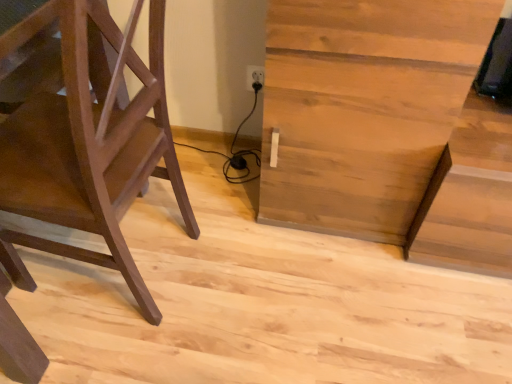
Question: Is light brown wood table at center bigger than matte brown ladder at left?

Choices:
 (A) yes
 (B) no

Answer: (A)

Question: Are light brown wood table at center and matte brown ladder at left far apart?

Choices:
 (A) no
 (B) yes

Answer: (A)

Question: Is the position of light brown wood table at center less distant than that of matte brown ladder at left?

Choices:
 (A) no
 (B) yes

Answer: (A)

Question: From a real-world perspective, is light brown wood table at center positioned under matte brown ladder at left based on gravity?

Choices:
 (A) yes
 (B) no

Answer: (A)

Question: Is matte brown ladder at left a part of light brown wood table at center?

Choices:
 (A) no
 (B) yes

Answer: (A)

Question: Is light brown wood table at center looking in the opposite direction of matte brown ladder at left?

Choices:
 (A) no
 (B) yes

Answer: (A)

Question: From the image's perspective, is matte brown ladder at left beneath light brown wood table at center?

Choices:
 (A) no
 (B) yes

Answer: (B)

Question: Is matte brown ladder at left further to the viewer compared to light brown wood table at center?

Choices:
 (A) yes
 (B) no

Answer: (B)

Question: Can you confirm if matte brown ladder at left is positioned to the right of light brown wood table at center?

Choices:
 (A) yes
 (B) no

Answer: (B)

Question: Is matte brown ladder at left positioned in front of light brown wood table at center?

Choices:
 (A) no
 (B) yes

Answer: (B)

Question: Is matte brown ladder at left at the left side of light brown wood table at center?

Choices:
 (A) no
 (B) yes

Answer: (B)

Question: Does matte brown ladder at left have a greater width compared to light brown wood table at center?

Choices:
 (A) no
 (B) yes

Answer: (B)

Question: From the image's perspective, relative to light brown wood table at center, is matte brown ladder at left above or below?

Choices:
 (A) below
 (B) above

Answer: (A)